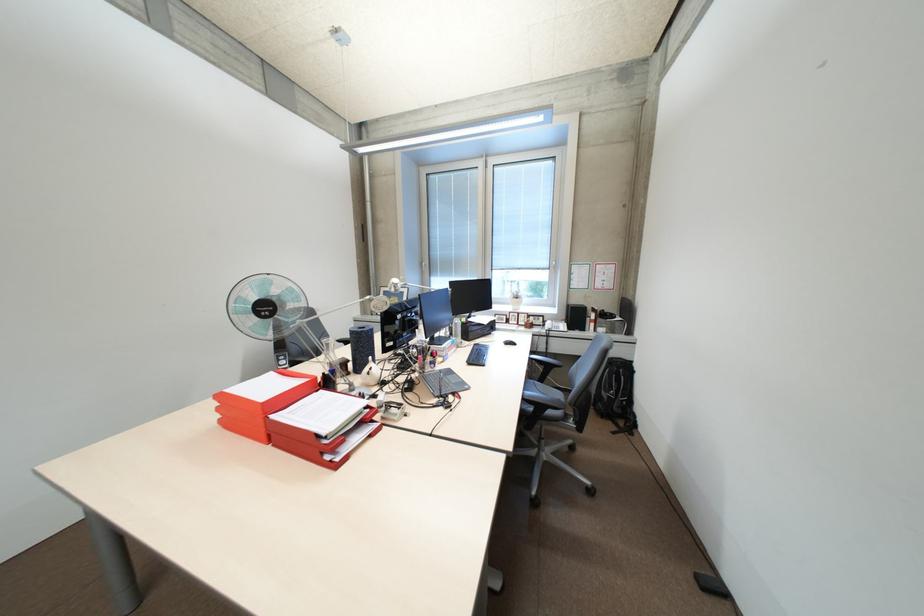
Where would you lift the phone handset? Please return your answer as a coordinate pair (x, y).

(392, 411)